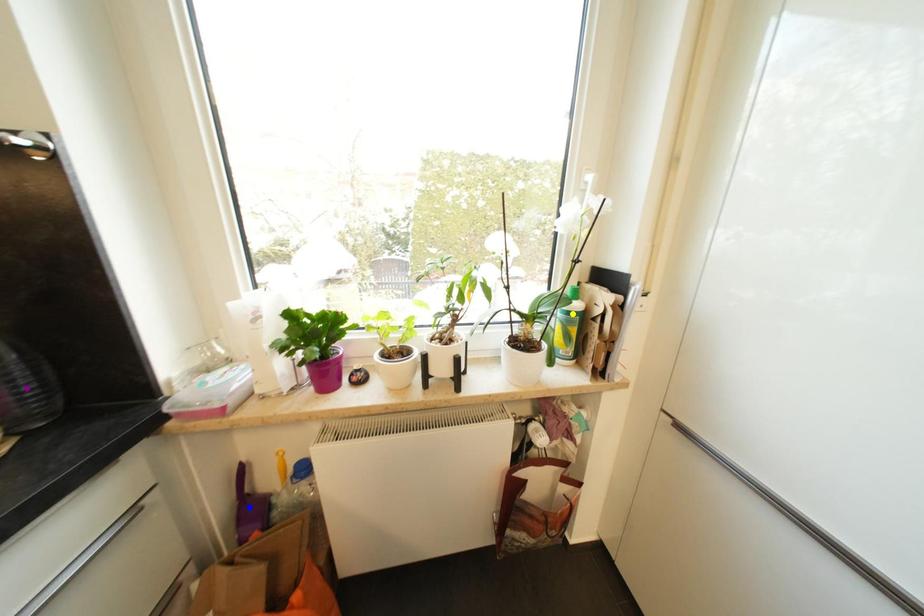
Order these from nearest to farthest:
1. yellow point
2. purple point
3. blue point

purple point
yellow point
blue point